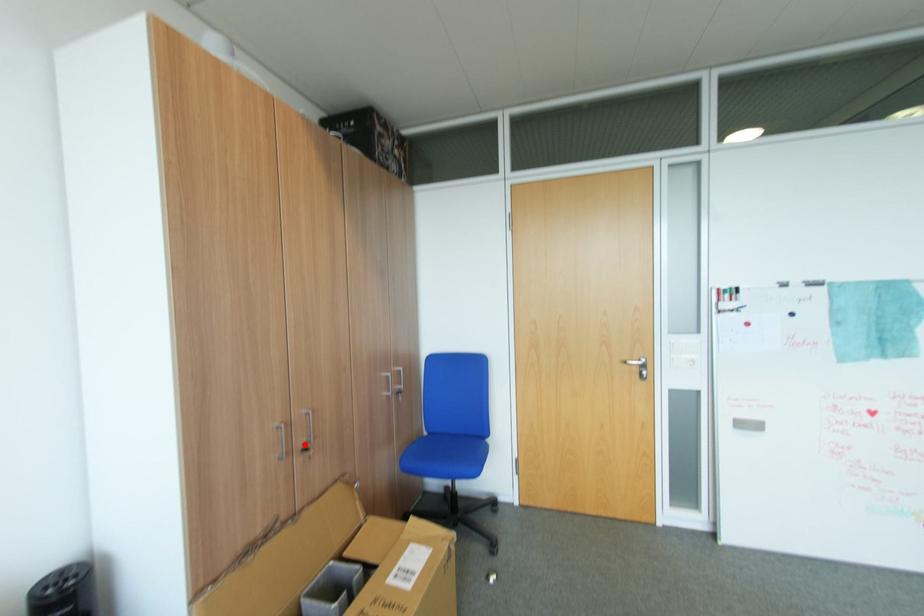
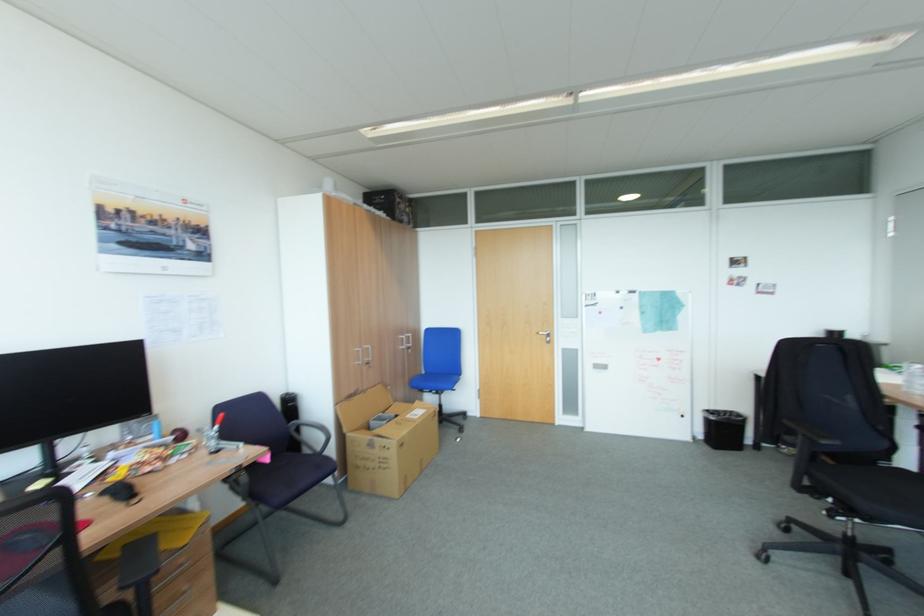
The point at the highlighted location is marked in the first image. Where is the corresponding point in the second image?

(371, 360)